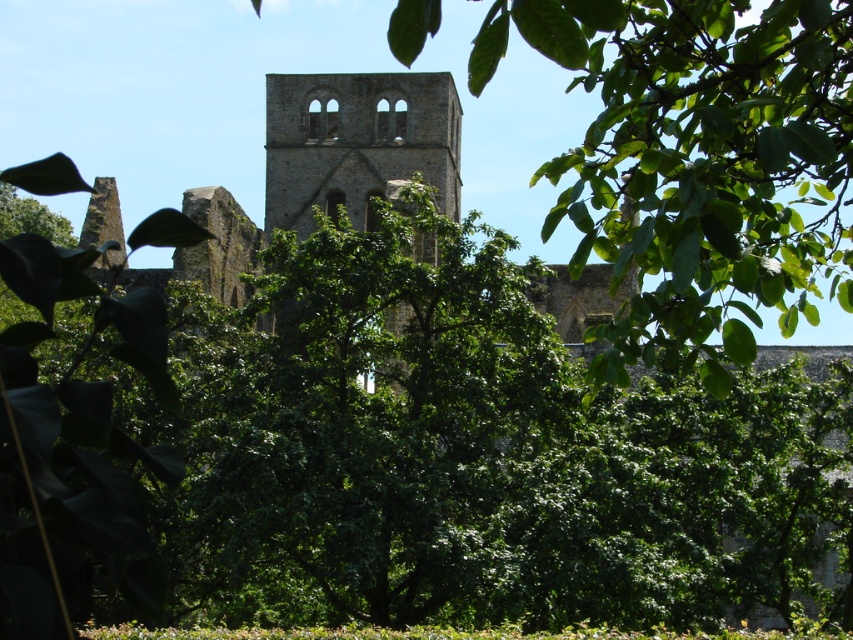
Question: Among these points, which one is farthest from the camera?

Choices:
 (A) (378, 163)
 (B) (822, 512)

Answer: (A)

Question: Does green leafy tree at center appear under brown stone tower at center?

Choices:
 (A) yes
 (B) no

Answer: (A)

Question: Is green leafy tree at center below brown stone tower at center?

Choices:
 (A) yes
 (B) no

Answer: (A)

Question: Does green leafy tree at center have a greater width compared to brown stone tower at center?

Choices:
 (A) yes
 (B) no

Answer: (A)

Question: Which object is closer to the camera taking this photo?

Choices:
 (A) green leafy tree at center
 (B) brown stone tower at center

Answer: (A)